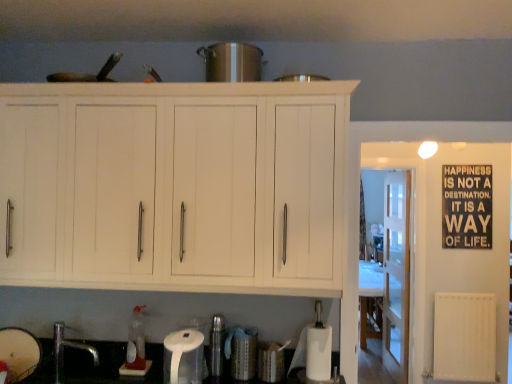
What are the coordinates of `empty space that is ontop of white plastic radiator at right (from a real-world perspective)` in the screenshot? It's located at (469, 284).